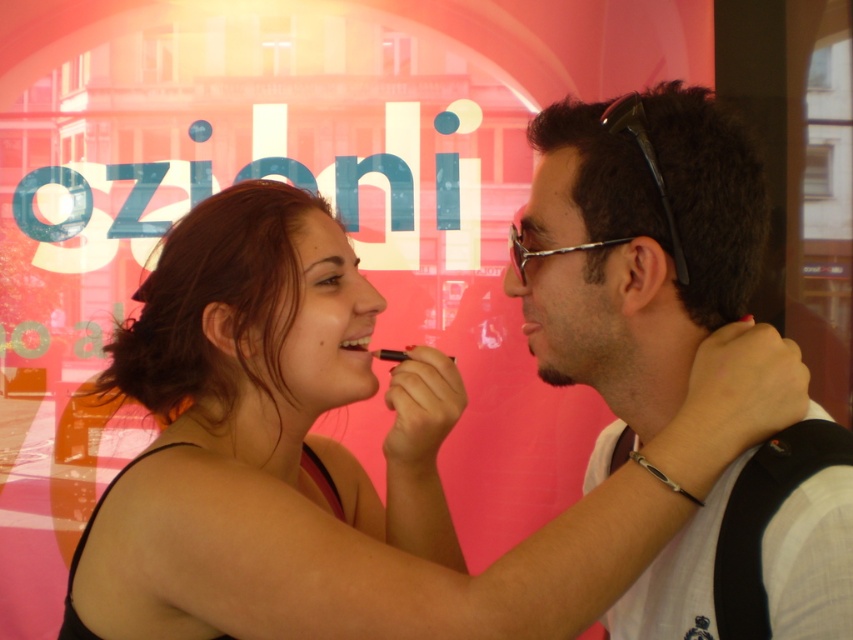
Is matte white shirt at center below smooth skin face at center?

Indeed, matte white shirt at center is positioned under smooth skin face at center.

Is matte white shirt at center to the right of smooth skin face at center from the viewer's perspective?

Correct, you'll find matte white shirt at center to the right of smooth skin face at center.

Is point (608, 378) less distant than point (607, 376)?

No, (608, 378) is behind (607, 376).

Identify the location of matte white shirt at center. (635, 250).

Describe the element at coordinates (635, 250) in the screenshot. I see `matte white shirt at center` at that location.

Which is in front, point (726, 131) or point (322, 280)?

Point (726, 131)

The height and width of the screenshot is (640, 853). What do you see at coordinates (635, 250) in the screenshot?
I see `matte white shirt at center` at bounding box center [635, 250].

You are a GUI agent. You are given a task and a screenshot of the screen. Output one action in this format:
    pyautogui.click(x=<x>, y=<y>)
    Task: Click on the matte white shirt at center
    This screenshot has width=853, height=640.
    Given the screenshot: What is the action you would take?
    pyautogui.click(x=635, y=250)

How much distance is there between smooth skin girl at center and smooth skin face at center?

The distance of smooth skin girl at center from smooth skin face at center is 9.04 inches.

This screenshot has height=640, width=853. Find the location of `smooth skin girl at center`. smooth skin girl at center is located at coordinates (352, 460).